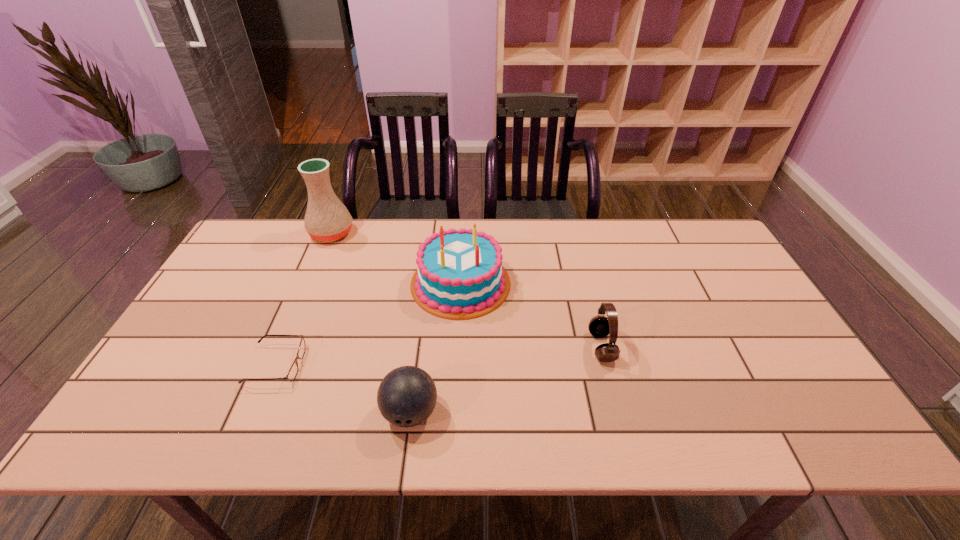
Identify the location of free point located on the ear pads of the rightmost object. (559, 347).

In order to click on vacant space situated on the ear pads of the rightmost object in this screenshot , I will do `click(551, 347)`.

What are the coordinates of `free spot located 0.140m on the lenses of the shortest object` in the screenshot? It's located at coord(357,365).

Where is `pottery that is at the far edge`? This screenshot has height=540, width=960. pottery that is at the far edge is located at coordinates (327, 219).

Find the location of a particular element. birthday cake that is positioned at the far edge is located at coordinates (459, 275).

Locate an element on the screen. This screenshot has width=960, height=540. object present at the near edge is located at coordinates (406, 397).

This screenshot has width=960, height=540. In order to click on vacant region at the far edge in this screenshot , I will do `click(628, 225)`.

In the image, there is a desktop. At what (x,y) coordinates should I click in order to perform the action: click on free region at the near edge. Please return your answer as a coordinate pair (x, y). The height and width of the screenshot is (540, 960). Looking at the image, I should click on (280, 409).

This screenshot has width=960, height=540. I want to click on vacant space at the right edge, so click(727, 276).

Identify the location of free point at the far left corner. click(263, 232).